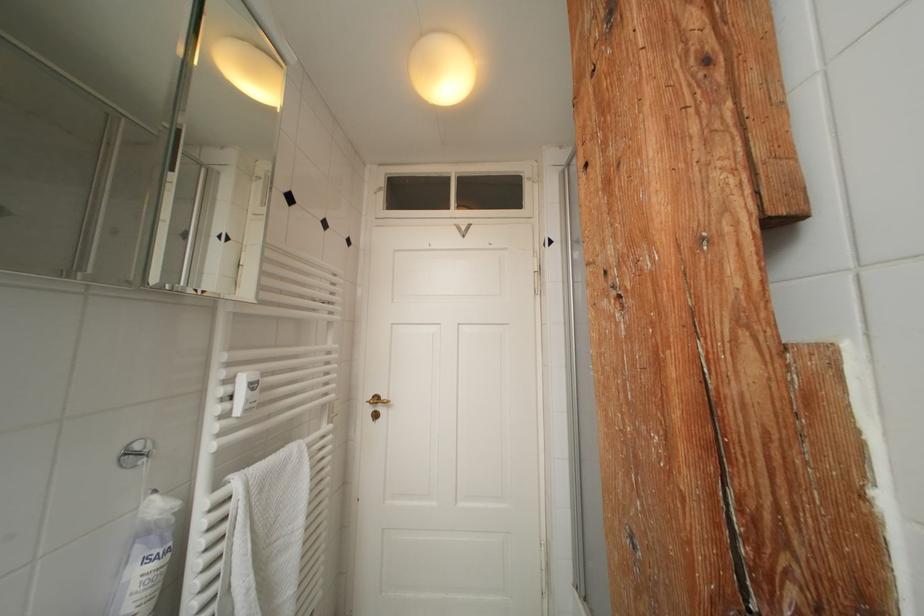
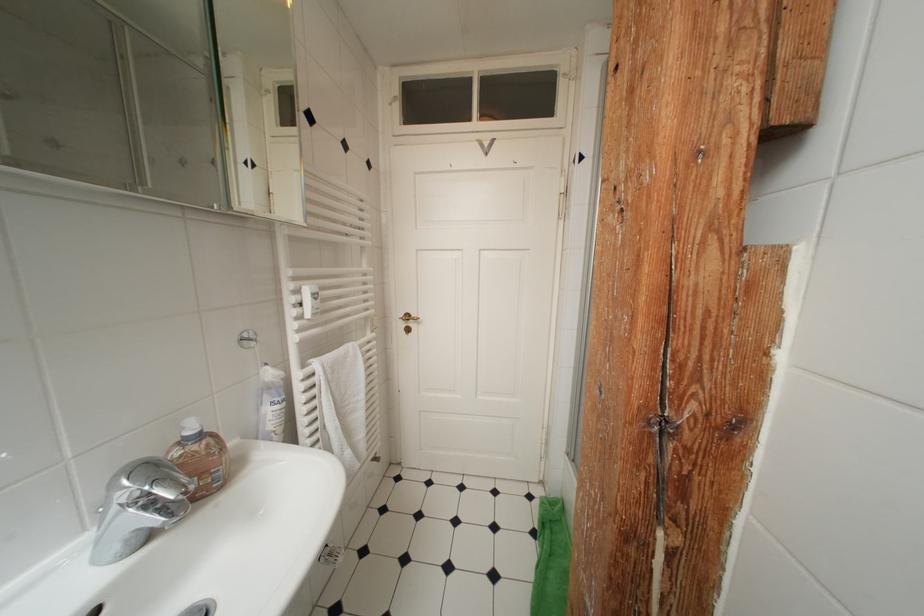
Locate, in the second image, the point that corresponds to [244,484] in the first image.

(322, 368)